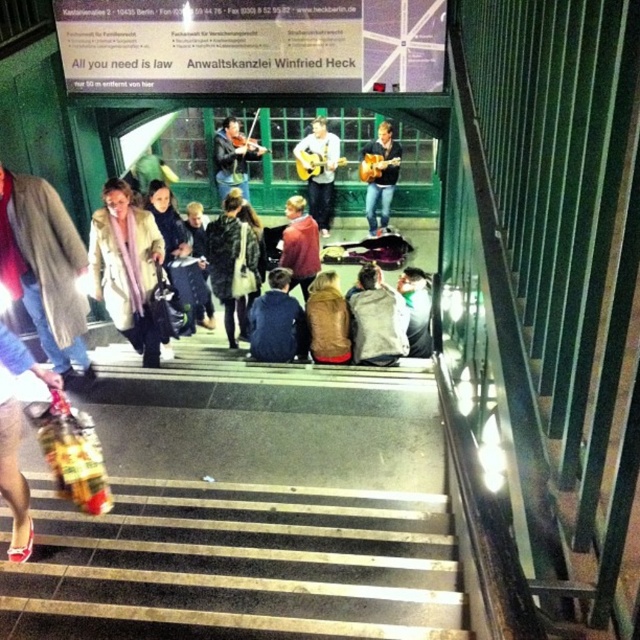
You are standing at the bottom of the stairs and want to look up to the green metal railing at upper center. What are the coordinates of the point you should focus on?

The coordinates of the green metal railing at upper center are at point (548,276).

You are standing at the bottom of the stairs and want to know which object is smaller between the red sweater at center and the shiny black violin at upper center. Can you tell me?

The red sweater at center is smaller than the shiny black violin at upper center.